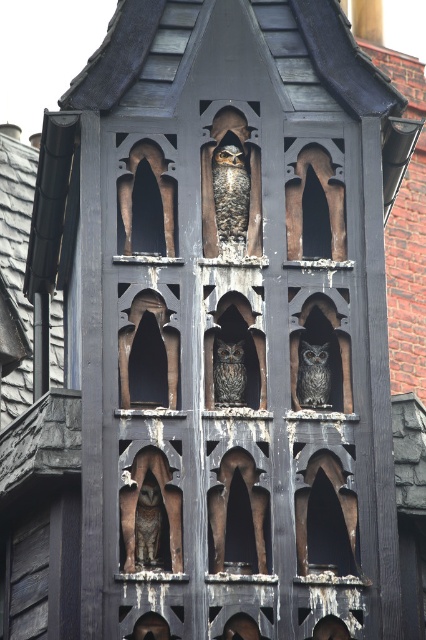
You are an architect designing a new garden ornament and want to ensure proper spacing between the brown textured owl at lower left and the gray textured owl at center. Based on their sizes, which owl requires more space between them and neighboring objects?

The gray textured owl at center requires more space because its width is greater than the brown textured owl at lower left.

You are an architect designing a new garden structure and want to place two owls similar to those in the image. The brown textured owl at lower left and the dark gray textured owl at center must be arranged in the same spatial relationship as shown. Which owl should be placed to the left of the other?

The brown textured owl at lower left should be placed to the left of the dark gray textured owl at center, as it is positioned on the left side of it in the original image.